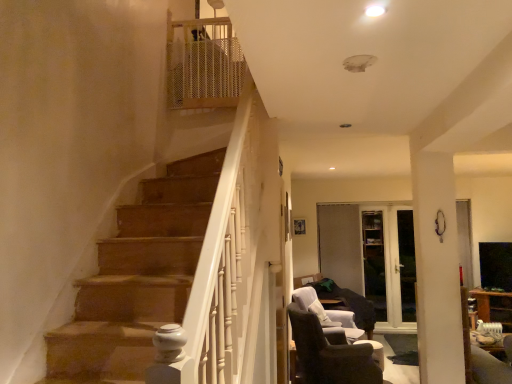
What do you see at coordinates (407, 264) in the screenshot? Image resolution: width=512 pixels, height=384 pixels. I see `transparent glass door at center, which ranks as the second glass door in left-to-right order` at bounding box center [407, 264].

Where is `dark brown fabric chair at lower right, acting as the 2th chair starting from the front`? dark brown fabric chair at lower right, acting as the 2th chair starting from the front is located at coordinates (327, 313).

Identify the location of dark brown fabric chair at lower right, the first chair in the front-to-back sequence. The image size is (512, 384). (330, 353).

From the picture: Considering the sizes of objects white glossy ceiling light at upper center and transparent glass door at center, placed as the 1th glass door when sorted from right to left, in the image provided, who is bigger, white glossy ceiling light at upper center or transparent glass door at center, placed as the 1th glass door when sorted from right to left,?

transparent glass door at center, placed as the 1th glass door when sorted from right to left.

Would you say white glossy ceiling light at upper center is a long distance from transparent glass door at center, placed as the 1th glass door when sorted from right to left?

That's right, there is a large distance between white glossy ceiling light at upper center and transparent glass door at center, placed as the 1th glass door when sorted from right to left.

Does point (371, 14) appear closer or farther from the camera than point (408, 256)?

Point (371, 14) is closer to the camera than point (408, 256).

From their relative heights in the image, would you say white glossy ceiling light at upper center is taller or shorter than transparent glass door at center, which ranks as the second glass door in left-to-right order?

In the image, white glossy ceiling light at upper center appears to be shorter than transparent glass door at center, which ranks as the second glass door in left-to-right order.

Is transparent glass door at center, which is the first glass door from left to right, to the right of dark brown fabric chair at lower right, acting as the 2th chair starting from the front, from the viewer's perspective?

Yes, transparent glass door at center, which is the first glass door from left to right, is to the right of dark brown fabric chair at lower right, acting as the 2th chair starting from the front.

Which is in front, transparent glass door at center, positioned as the 2th glass door in right-to-left order, or dark brown fabric chair at lower right, which appears as the 1th chair when viewed from the back?

dark brown fabric chair at lower right, which appears as the 1th chair when viewed from the back.

Which is in front, point (373, 233) or point (338, 319)?

The point (338, 319) is closer to the camera.

Is white glossy ceiling light at upper center at the back of dark brown fabric chair at lower right, which appears as the 1th chair when viewed from the back?

No, dark brown fabric chair at lower right, which appears as the 1th chair when viewed from the back, is not facing the opposite direction of white glossy ceiling light at upper center.

Based on their sizes in the image, would you say dark brown fabric chair at lower right, which appears as the 1th chair when viewed from the back, is bigger or smaller than white glossy ceiling light at upper center?

Considering their sizes, dark brown fabric chair at lower right, which appears as the 1th chair when viewed from the back, takes up more space than white glossy ceiling light at upper center.

Which object is thinner, dark brown fabric chair at lower right, acting as the 2th chair starting from the front, or white glossy ceiling light at upper center?

Thinner between the two is white glossy ceiling light at upper center.

I want to click on light in front of the dark brown fabric chair at lower right, which appears as the 1th chair when viewed from the back, so click(x=375, y=11).

Could you tell me if dark brown fabric chair at lower right, the first chair in the front-to-back sequence, is turned towards transparent glass door at center, placed as the 1th glass door when sorted from right to left?

No, dark brown fabric chair at lower right, the first chair in the front-to-back sequence, is not facing towards transparent glass door at center, placed as the 1th glass door when sorted from right to left.

Is dark brown fabric chair at lower right, which is the 2th chair from back to front, at the right side of transparent glass door at center, which ranks as the second glass door in left-to-right order?

No, dark brown fabric chair at lower right, which is the 2th chair from back to front, is not to the right of transparent glass door at center, which ranks as the second glass door in left-to-right order.

Considering the relative sizes of dark brown fabric chair at lower right, the first chair in the front-to-back sequence, and transparent glass door at center, placed as the 1th glass door when sorted from right to left, in the image provided, is dark brown fabric chair at lower right, the first chair in the front-to-back sequence, thinner than transparent glass door at center, placed as the 1th glass door when sorted from right to left,?

In fact, dark brown fabric chair at lower right, the first chair in the front-to-back sequence, might be wider than transparent glass door at center, placed as the 1th glass door when sorted from right to left.

Is dark brown fabric chair at lower right, the first chair in the front-to-back sequence, bigger than transparent glass door at center, placed as the 1th glass door when sorted from right to left?

Yes.

Between dark brown fabric chair at lower right, which appears as the 1th chair when viewed from the back, and transparent glass door at center, placed as the 1th glass door when sorted from right to left, which one has smaller size?

Smaller between the two is transparent glass door at center, placed as the 1th glass door when sorted from right to left.

Considering the relative sizes of dark brown fabric chair at lower right, which appears as the 1th chair when viewed from the back, and transparent glass door at center, placed as the 1th glass door when sorted from right to left, in the image provided, is dark brown fabric chair at lower right, which appears as the 1th chair when viewed from the back, shorter than transparent glass door at center, placed as the 1th glass door when sorted from right to left,?

Indeed, dark brown fabric chair at lower right, which appears as the 1th chair when viewed from the back, has a lesser height compared to transparent glass door at center, placed as the 1th glass door when sorted from right to left.

From the picture: Is dark brown fabric chair at lower right, which appears as the 1th chair when viewed from the back, next to transparent glass door at center, placed as the 1th glass door when sorted from right to left?

No, dark brown fabric chair at lower right, which appears as the 1th chair when viewed from the back, is not making contact with transparent glass door at center, placed as the 1th glass door when sorted from right to left.

Could you tell me if dark brown fabric chair at lower right, which appears as the 1th chair when viewed from the back, is turned towards transparent glass door at center, placed as the 1th glass door when sorted from right to left?

No, dark brown fabric chair at lower right, which appears as the 1th chair when viewed from the back, is not oriented towards transparent glass door at center, placed as the 1th glass door when sorted from right to left.

From a real-world perspective, which object stands above the other?

In real-world perspective, dark brown fabric chair at lower right, the first chair in the front-to-back sequence, is above.

Is dark brown fabric chair at lower right, which is the 2th chair from back to front, positioned beyond the bounds of dark brown fabric chair at lower right, acting as the 2th chair starting from the front?

Yes, dark brown fabric chair at lower right, which is the 2th chair from back to front, is outside of dark brown fabric chair at lower right, acting as the 2th chair starting from the front.

How many degrees apart are the facing directions of dark brown fabric chair at lower right, which is the 2th chair from back to front, and dark brown fabric chair at lower right, which appears as the 1th chair when viewed from the back?

There is a 55.5-degree angle between the facing directions of dark brown fabric chair at lower right, which is the 2th chair from back to front, and dark brown fabric chair at lower right, which appears as the 1th chair when viewed from the back.

Considering the sizes of dark brown fabric chair at lower right, the first chair in the front-to-back sequence, and dark brown fabric chair at lower right, which appears as the 1th chair when viewed from the back, in the image, is dark brown fabric chair at lower right, the first chair in the front-to-back sequence, taller or shorter than dark brown fabric chair at lower right, which appears as the 1th chair when viewed from the back,?

dark brown fabric chair at lower right, the first chair in the front-to-back sequence, is taller than dark brown fabric chair at lower right, which appears as the 1th chair when viewed from the back.

Does dark brown fabric chair at lower right, which is the 2th chair from back to front, have a lesser width compared to transparent glass door at center, positioned as the 2th glass door in right-to-left order?

No, dark brown fabric chair at lower right, which is the 2th chair from back to front, is not thinner than transparent glass door at center, positioned as the 2th glass door in right-to-left order.

From a real-world perspective, is dark brown fabric chair at lower right, which is the 2th chair from back to front, located higher than transparent glass door at center, positioned as the 2th glass door in right-to-left order?

Actually, dark brown fabric chair at lower right, which is the 2th chair from back to front, is physically below transparent glass door at center, positioned as the 2th glass door in right-to-left order, in the real world.

Is dark brown fabric chair at lower right, which is the 2th chair from back to front, not near transparent glass door at center, which is the first glass door from left to right?

Yes, dark brown fabric chair at lower right, which is the 2th chair from back to front, is far from transparent glass door at center, which is the first glass door from left to right.

Based on the photo, is dark brown fabric chair at lower right, the first chair in the front-to-back sequence, bigger than transparent glass door at center, positioned as the 2th glass door in right-to-left order?

Yes.

This screenshot has height=384, width=512. Find the location of `light in front of the transparent glass door at center, placed as the 1th glass door when sorted from right to left`. light in front of the transparent glass door at center, placed as the 1th glass door when sorted from right to left is located at coordinates (375, 11).

Starting from the dark brown fabric chair at lower right, which appears as the 1th chair when viewed from the back, which glass door is the 2nd one behind? Please provide its 2D coordinates.

[(374, 262)]

When comparing their distances from transparent glass door at center, positioned as the 2th glass door in right-to-left order, does transparent glass door at center, placed as the 1th glass door when sorted from right to left, or dark brown fabric chair at lower right, which appears as the 1th chair when viewed from the back, seem further?

dark brown fabric chair at lower right, which appears as the 1th chair when viewed from the back, lies further to transparent glass door at center, positioned as the 2th glass door in right-to-left order, than the other object.

From the image, which object appears to be nearer to dark brown fabric chair at lower right, the first chair in the front-to-back sequence, white glossy ceiling light at upper center or transparent glass door at center, placed as the 1th glass door when sorted from right to left?

The object closer to dark brown fabric chair at lower right, the first chair in the front-to-back sequence, is transparent glass door at center, placed as the 1th glass door when sorted from right to left.

From the image, which object appears to be nearer to white glossy ceiling light at upper center, transparent glass door at center, which is the first glass door from left to right, or transparent glass door at center, placed as the 1th glass door when sorted from right to left?

transparent glass door at center, which is the first glass door from left to right.

Estimate the real-world distances between objects in this image. Which object is further from white glossy ceiling light at upper center, transparent glass door at center, placed as the 1th glass door when sorted from right to left, or dark brown fabric chair at lower right, the first chair in the front-to-back sequence?

transparent glass door at center, placed as the 1th glass door when sorted from right to left, is further to white glossy ceiling light at upper center.

Based on their spatial positions, is dark brown fabric chair at lower right, which appears as the 1th chair when viewed from the back, or transparent glass door at center, which ranks as the second glass door in left-to-right order, further from white glossy ceiling light at upper center?

transparent glass door at center, which ranks as the second glass door in left-to-right order, is positioned further to the anchor white glossy ceiling light at upper center.

Considering their positions, is dark brown fabric chair at lower right, acting as the 2th chair starting from the front, positioned further to dark brown fabric chair at lower right, the first chair in the front-to-back sequence, than transparent glass door at center, positioned as the 2th glass door in right-to-left order?

Based on the image, transparent glass door at center, positioned as the 2th glass door in right-to-left order, appears to be further to dark brown fabric chair at lower right, the first chair in the front-to-back sequence.

Which object lies nearer to the anchor point transparent glass door at center, which is the first glass door from left to right, dark brown fabric chair at lower right, which is the 2th chair from back to front, or white glossy ceiling light at upper center?

dark brown fabric chair at lower right, which is the 2th chair from back to front.

Which object lies nearer to the anchor point white glossy ceiling light at upper center, transparent glass door at center, which ranks as the second glass door in left-to-right order, or transparent glass door at center, which is the first glass door from left to right?

The object closer to white glossy ceiling light at upper center is transparent glass door at center, which is the first glass door from left to right.

You are a GUI agent. You are given a task and a screenshot of the screen. Output one action in this format:
    pyautogui.click(x=<x>, y=<y>)
    Task: Click on the glass door between dark brown fabric chair at lower right, the first chair in the front-to-back sequence, and transparent glass door at center, which is the first glass door from left to right, in the front-back direction
    
    Given the screenshot: What is the action you would take?
    pyautogui.click(x=407, y=264)

This screenshot has width=512, height=384. In order to click on chair between white glossy ceiling light at upper center and dark brown fabric chair at lower right, which appears as the 1th chair when viewed from the back, in the front-back direction in this screenshot , I will do `click(330, 353)`.

The image size is (512, 384). What are the coordinates of `glass door between dark brown fabric chair at lower right, which appears as the 1th chair when viewed from the back, and transparent glass door at center, positioned as the 2th glass door in right-to-left order, in the front-back direction` in the screenshot? It's located at (407, 264).

The width and height of the screenshot is (512, 384). Find the location of `glass door between white glossy ceiling light at upper center and transparent glass door at center, which is the first glass door from left to right, from front to back`. glass door between white glossy ceiling light at upper center and transparent glass door at center, which is the first glass door from left to right, from front to back is located at coordinates (407, 264).